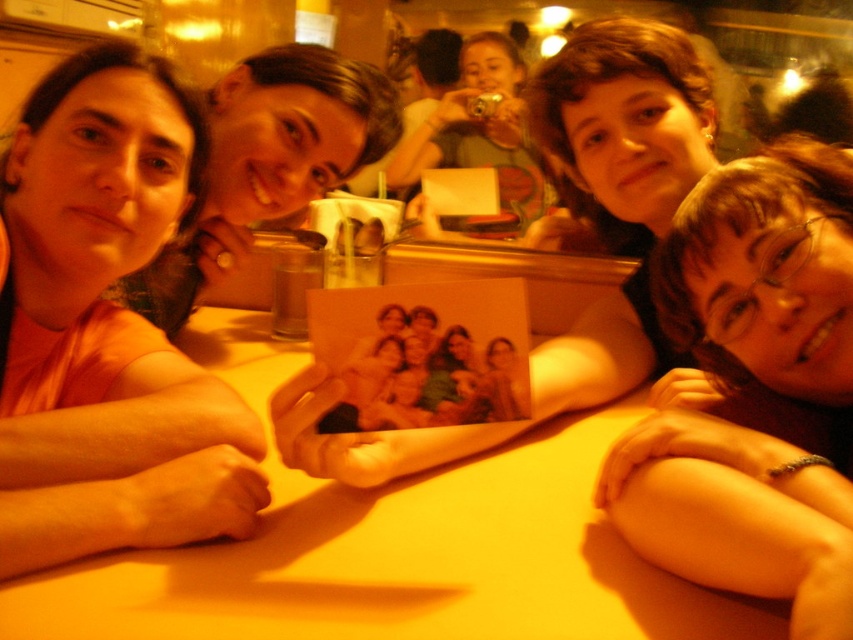
You are a photographer trying to capture a candid shot of the group. You notice a point at coordinates (x=107, y=326) on your camera screen. What object is located at this point?

The point at coordinates (x=107, y=326) marks the matte orange shirt at left.

You are a photographer trying to capture a group shot of the people at the table. You notice the matte orange shirt at left and the smooth skin at lower right. Which object should you focus on if you want to ensure the larger one is in sharp focus?

The matte orange shirt at left is larger in size than the smooth skin at lower right, so you should focus on the matte orange shirt at left to ensure it is in sharp focus.

You are a photographer trying to capture a group photo of the people at the table. You want to ensure that both the matte orange shirt at left and the smooth skin at lower right are clearly visible in the frame. Given their sizes, which object should you focus on first to ensure proper exposure?

The matte orange shirt at left is wider than the smooth skin at lower right, so focusing on the matte orange shirt at left first will ensure proper exposure since it covers a larger area in the frame.